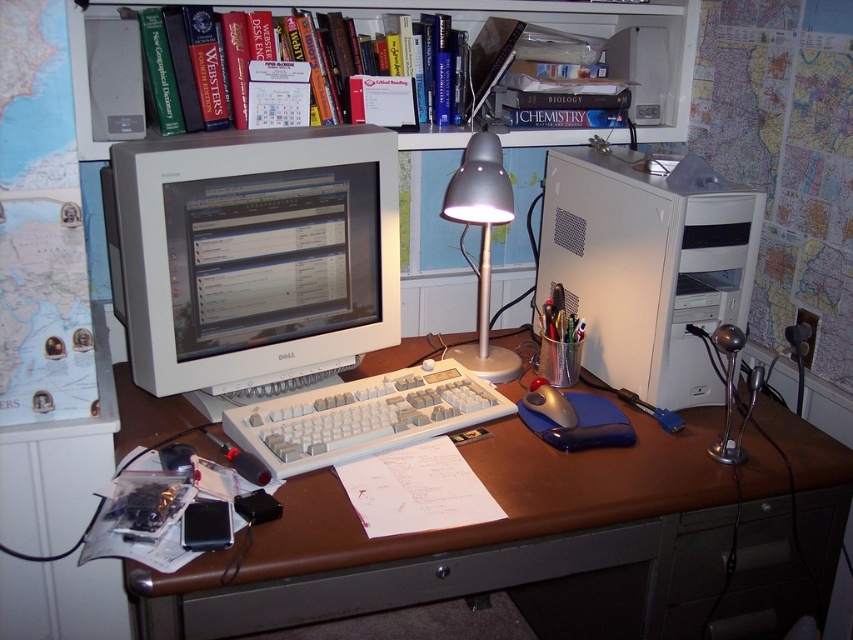
Question: Does metallic gray desk lamp at center have a larger size compared to matte gray mouse at center?

Choices:
 (A) no
 (B) yes

Answer: (B)

Question: Can you confirm if white plastic keyboard at center is smaller than matte gray mouse at center?

Choices:
 (A) yes
 (B) no

Answer: (B)

Question: Which object is closer to the camera taking this photo?

Choices:
 (A) hardcover books at upper center
 (B) white plastic keyboard at center

Answer: (B)

Question: Which of the following is the farthest from the observer?

Choices:
 (A) (532, 390)
 (B) (306, 429)
 (C) (541, 3)
 (D) (466, 157)

Answer: (C)

Question: Does white plastic keyboard at center have a smaller size compared to matte gray mouse at center?

Choices:
 (A) no
 (B) yes

Answer: (A)

Question: Which of these objects is positioned closest to the hardcover books at upper center?

Choices:
 (A) metallic gray desk lamp at center
 (B) white plastic computer tower at center-right
 (C) hardcover book at upper center
 (D) white plastic keyboard at center

Answer: (C)